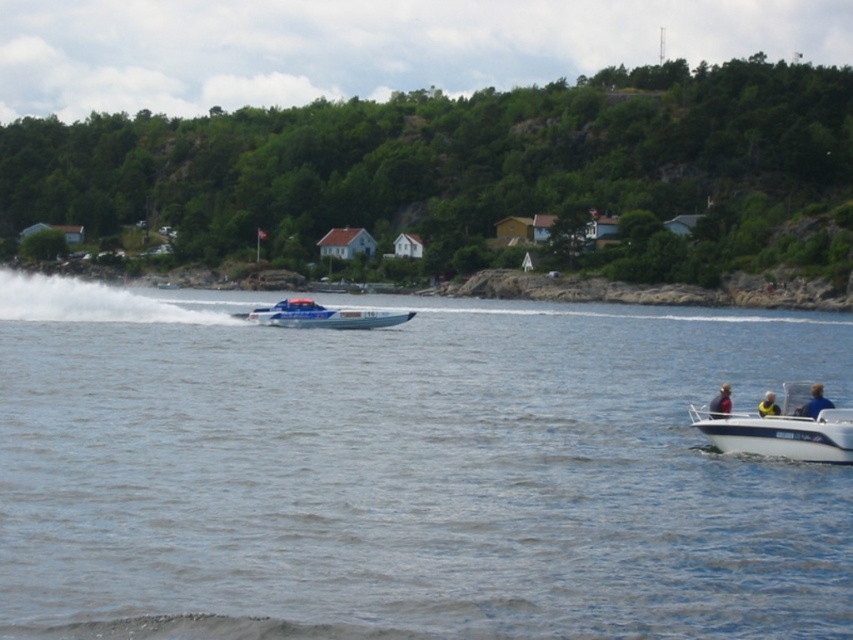
Is green leafy hillside at upper center wider than blue glossy speedboat at center?

Yes, green leafy hillside at upper center is wider than blue glossy speedboat at center.

Between green leafy hillside at upper center and blue glossy speedboat at center, which one appears on the left side from the viewer's perspective?

green leafy hillside at upper center

Is point (372, 100) positioned after point (381, 317)?

Yes, point (372, 100) is behind point (381, 317).

Where is `green leafy hillside at upper center`? green leafy hillside at upper center is located at coordinates (469, 170).

Is blue water at center smaller than green leafy hillside at upper center?

Indeed, blue water at center has a smaller size compared to green leafy hillside at upper center.

Does blue water at center appear over green leafy hillside at upper center?

No.

Does point (392, 428) come in front of point (323, 145)?

That is True.

Locate an element on the screen. blue water at center is located at coordinates (405, 472).

Is point (613, 198) positioned in front of point (809, 406)?

No, it is not.

Is point (511, 195) behind point (814, 385)?

Yes, it is.

I want to click on green leafy hillside at upper center, so click(x=469, y=170).